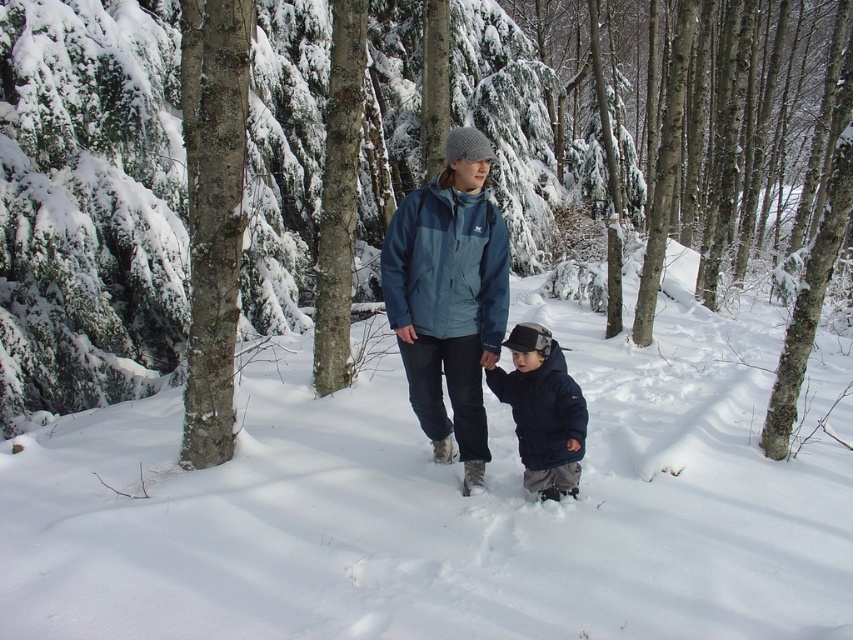
Which of these two, matte blue jacket at center or navy blue fleece jacket at center, stands shorter?

navy blue fleece jacket at center

Which is behind, point (494, 326) or point (577, 477)?

The point (577, 477) is more distant.

This screenshot has height=640, width=853. What do you see at coordinates (450, 298) in the screenshot?
I see `matte blue jacket at center` at bounding box center [450, 298].

Find the location of `matte blue jacket at center`. matte blue jacket at center is located at coordinates [450, 298].

Does brown rough tree trunk at center have a lesser height compared to matte blue jacket at center?

No.

Can you confirm if brown rough tree trunk at center is positioned above matte blue jacket at center?

Yes, brown rough tree trunk at center is above matte blue jacket at center.

This screenshot has width=853, height=640. Describe the element at coordinates (554, 150) in the screenshot. I see `brown rough tree trunk at center` at that location.

Image resolution: width=853 pixels, height=640 pixels. Identify the location of brown rough tree trunk at center. (554, 150).

Is smooth bark tree at center closer to camera compared to navy blue fleece jacket at center?

That is False.

Identify the location of smooth bark tree at center. (212, 212).